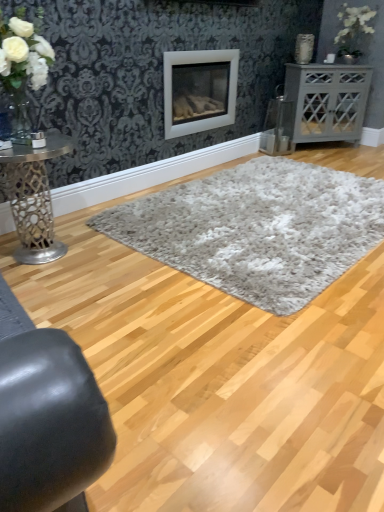
Question: Could you tell me if white fluffy rug at center, which is counted as the 1th plain, starting from the back, is turned towards metallic silver table at left, marked as the first table in a front-to-back arrangement?

Choices:
 (A) no
 (B) yes

Answer: (A)

Question: Is white fluffy rug at center, the second plain from the front, positioned before metallic silver table at left, acting as the first table starting from the left?

Choices:
 (A) no
 (B) yes

Answer: (A)

Question: Does white fluffy rug at center, which is counted as the 1th plain, starting from the back, have a larger size compared to metallic silver table at left, which is the 2th table in right-to-left order?

Choices:
 (A) no
 (B) yes

Answer: (B)

Question: Is white fluffy rug at center, the second plain from the front, far away from metallic silver table at left, acting as the first table starting from the left?

Choices:
 (A) yes
 (B) no

Answer: (B)

Question: Is white fluffy rug at center, the second plain from the front, smaller than metallic silver table at left, acting as the first table starting from the left?

Choices:
 (A) no
 (B) yes

Answer: (A)

Question: Are white fluffy rug at center, which is counted as the 1th plain, starting from the back, and metallic silver table at left, the second table positioned from the back, beside each other?

Choices:
 (A) no
 (B) yes

Answer: (A)

Question: Is gray matte cabinet at right, positioned as the 1th table in right-to-left order, positioned beyond the bounds of white shag rug at center, which is the second plain from back to front?

Choices:
 (A) yes
 (B) no

Answer: (A)

Question: Is gray matte cabinet at right, arranged as the second table when ordered from the bottom, at the right side of white shag rug at center, the 1th plain in the front-to-back sequence?

Choices:
 (A) no
 (B) yes

Answer: (B)

Question: From the image's perspective, is gray matte cabinet at right, the 2th table positioned from the front, below white shag rug at center, which is the second plain from back to front?

Choices:
 (A) no
 (B) yes

Answer: (A)

Question: Is gray matte cabinet at right, marked as the second table in a left-to-right arrangement, turned away from white shag rug at center, which is the second plain from back to front?

Choices:
 (A) yes
 (B) no

Answer: (B)

Question: From a real-world perspective, is gray matte cabinet at right, arranged as the second table when ordered from the bottom, physically below white shag rug at center, which is the second plain from back to front?

Choices:
 (A) yes
 (B) no

Answer: (B)

Question: Does gray matte cabinet at right, the first table from the top, have a lesser width compared to white shag rug at center, the 1th plain in the front-to-back sequence?

Choices:
 (A) yes
 (B) no

Answer: (A)

Question: Can you confirm if metallic silver table at left, which is counted as the 1th table, starting from the bottom, is shorter than white fluffy rug at center, the second plain from the front?

Choices:
 (A) yes
 (B) no

Answer: (B)